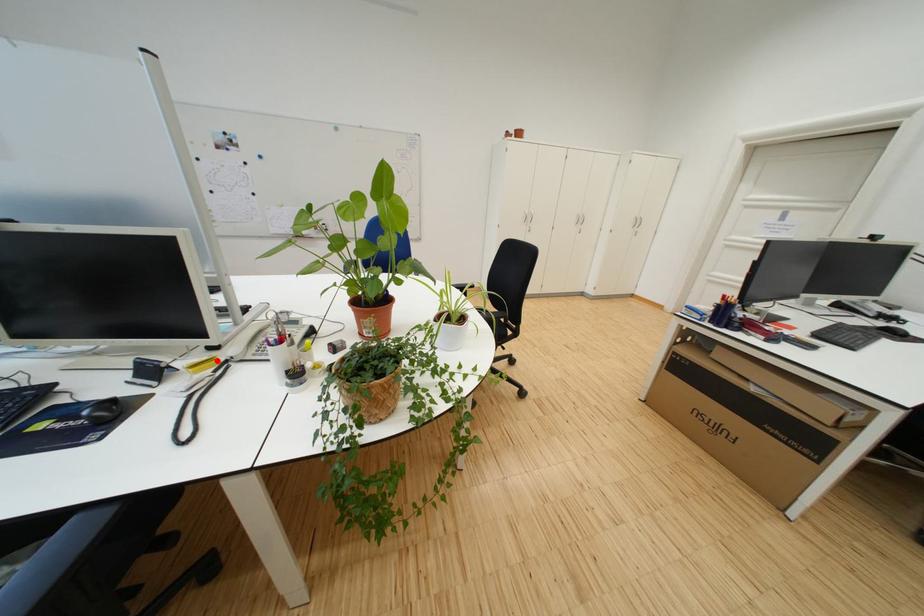
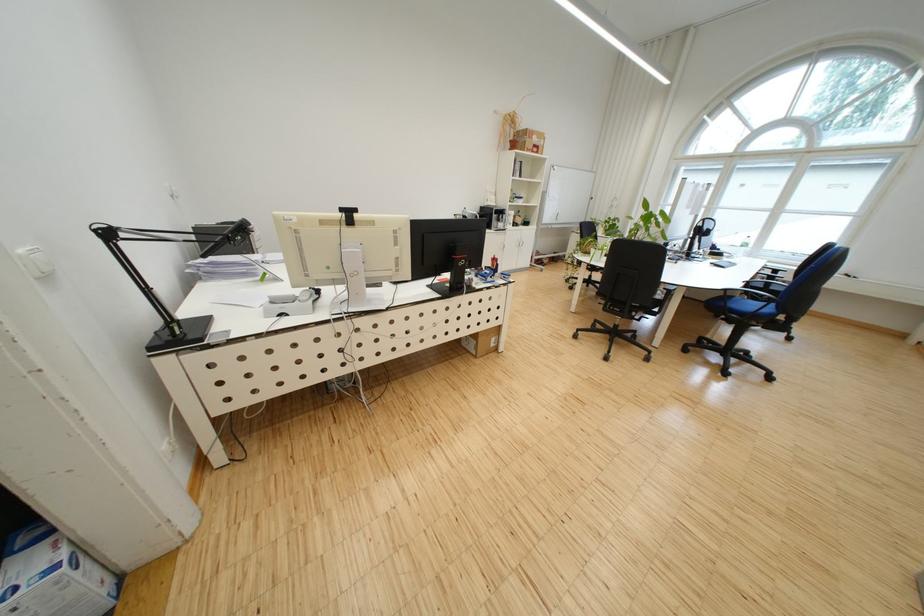
Question: I am providing you with two images of the same scene from different viewpoints. A red point is marked on the first image. Is the red point's position out of view in image 2?

Choices:
 (A) Yes
 (B) No

Answer: (A)